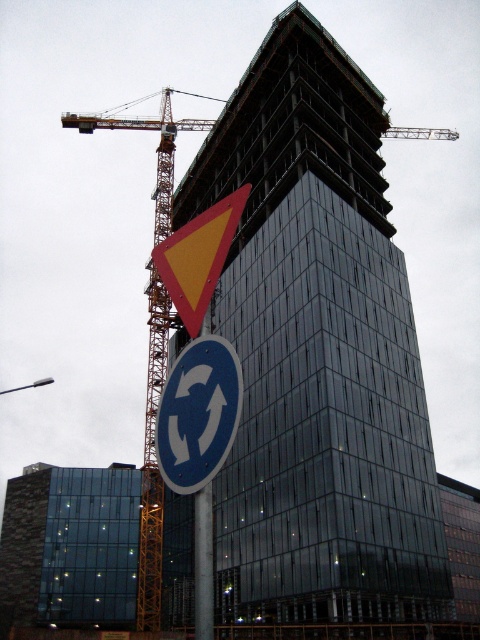
Is point (169, 112) farther from camera compared to point (235, 376)?

Yes, point (169, 112) is farther from viewer.

Find the location of `yellowmetalliccrane at left`. yellowmetalliccrane at left is located at coordinates (153, 458).

The image size is (480, 640). What do you see at coordinates (153, 458) in the screenshot?
I see `yellowmetalliccrane at left` at bounding box center [153, 458].

Find the location of a particular element. Image resolution: width=480 pixels, height=640 pixels. yellowmetalliccrane at left is located at coordinates (153, 458).

Is glassy steel tower at center above blue metallic sign at lower center?

Yes, glassy steel tower at center is above blue metallic sign at lower center.

Which is behind, point (330, 220) or point (164, 397)?

Positioned behind is point (330, 220).

Is point (218, 198) behind point (196, 396)?

Yes, it is behind point (196, 396).

Identify the location of glassy steel tower at center. The image size is (480, 640). (317, 353).

Who is more forward, (201, 476) or (206, 237)?

Point (201, 476) is in front.

Measure the distance between point (216, 452) and camera.

14.12 meters

Locate an element on the screen. This screenshot has width=480, height=640. blue metallic sign at lower center is located at coordinates (197, 413).

Identify the location of blue metallic sign at lower center. (197, 413).